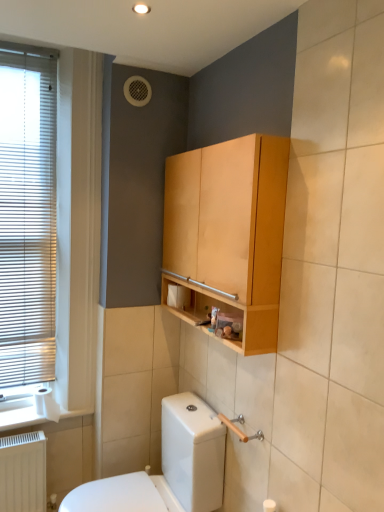
The image size is (384, 512). Identify the location of vacant space to the left of white matte toilet paper at lower left, the second toilet paper in the top-to-bottom sequence. [x=16, y=419].